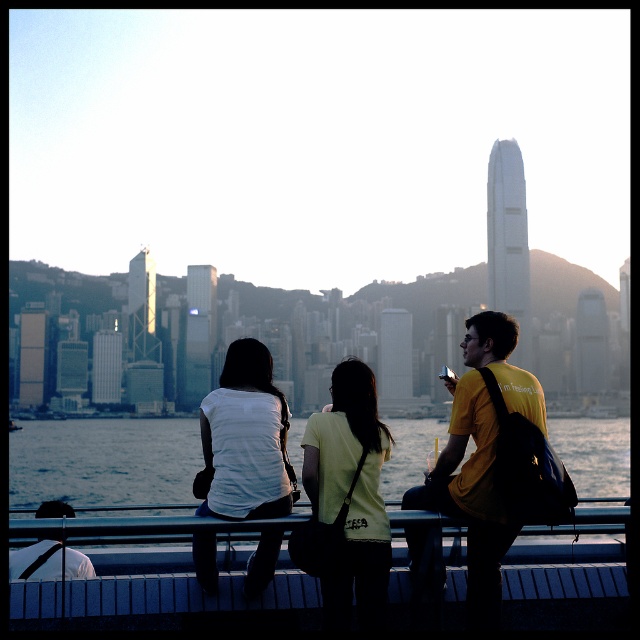
Does blue water at center have a greater width compared to light yellow t-shirt at center?

Indeed, blue water at center has a greater width compared to light yellow t-shirt at center.

Does blue water at center appear under light yellow t-shirt at center?

Result: No.

Find the location of a particular element. This screenshot has height=640, width=640. blue water at center is located at coordinates (104, 460).

The width and height of the screenshot is (640, 640). In order to click on blue water at center in this screenshot , I will do `click(104, 460)`.

Between point (316, 470) and point (253, 378), which one is positioned in front?

Positioned in front is point (316, 470).

Is light yellow t-shirt at center thinner than white matte shirt at center?

Indeed, light yellow t-shirt at center has a lesser width compared to white matte shirt at center.

Does point (364, 397) lie behind point (253, 364)?

No, it is not.

This screenshot has height=640, width=640. I want to click on light yellow t-shirt at center, so click(x=352, y=496).

Measure the distance between blue water at center and white matte shirt at center.

blue water at center is 42.92 meters away from white matte shirt at center.

Looking at this image, which of these two, blue water at center or white matte shirt at center, stands shorter?

With less height is blue water at center.

Is point (154, 486) positioned before point (276, 460)?

No, it is not.

What are the coordinates of `blue water at center` in the screenshot? It's located at point(104,460).